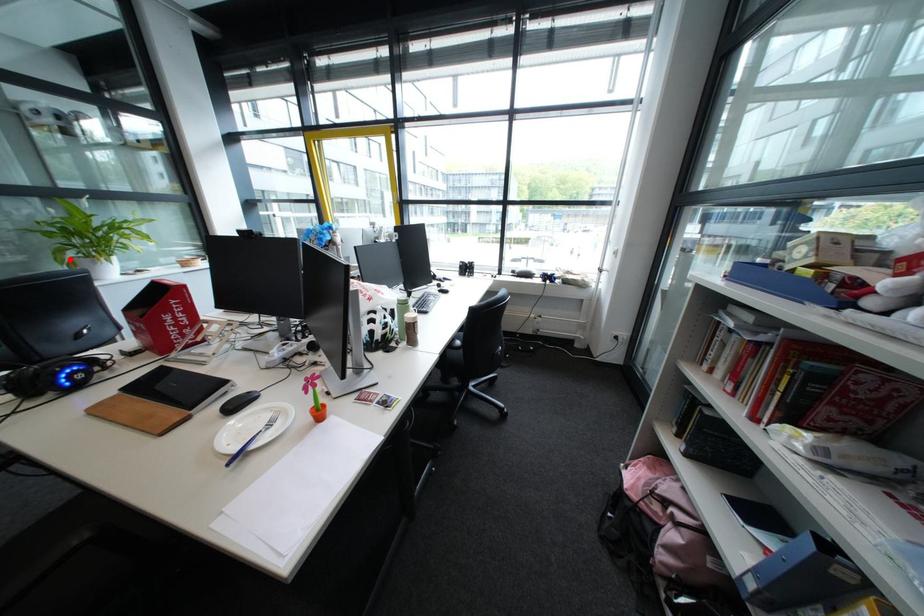
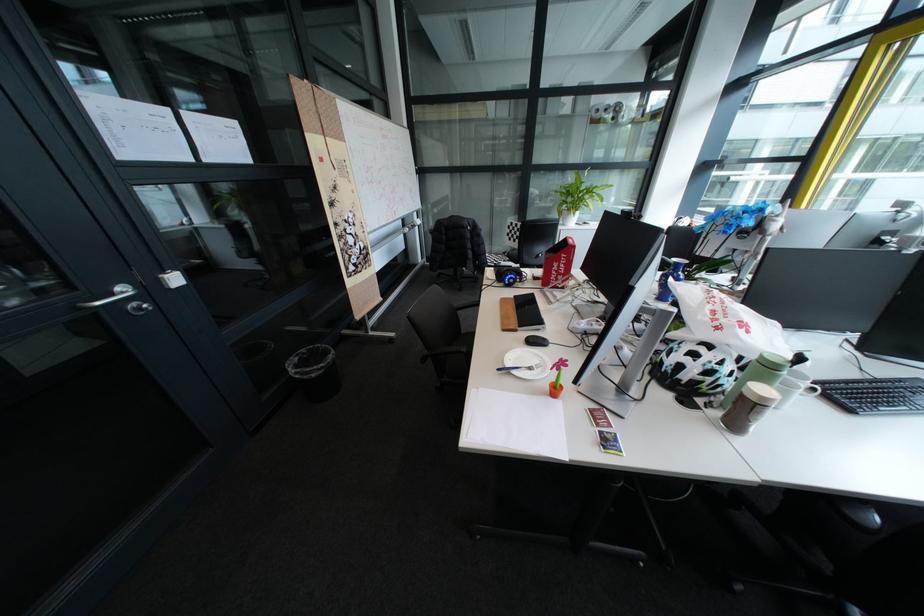
Where in the second image is the point corresponding to the highlighted location from the first image?

(572, 209)